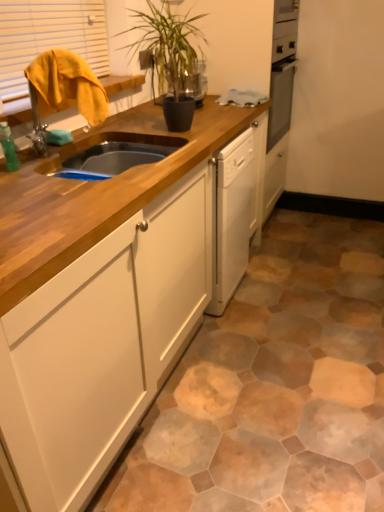
Image resolution: width=384 pixels, height=512 pixels. What are the coordinates of `free space to the left of green leafy plant at upper center` in the screenshot? It's located at (127, 119).